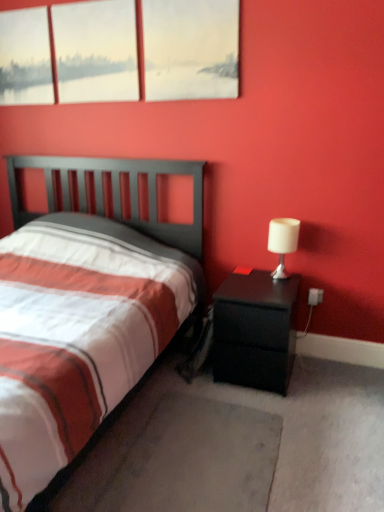
The width and height of the screenshot is (384, 512). I want to click on free space in front of black matte nightstand at right, so click(x=267, y=415).